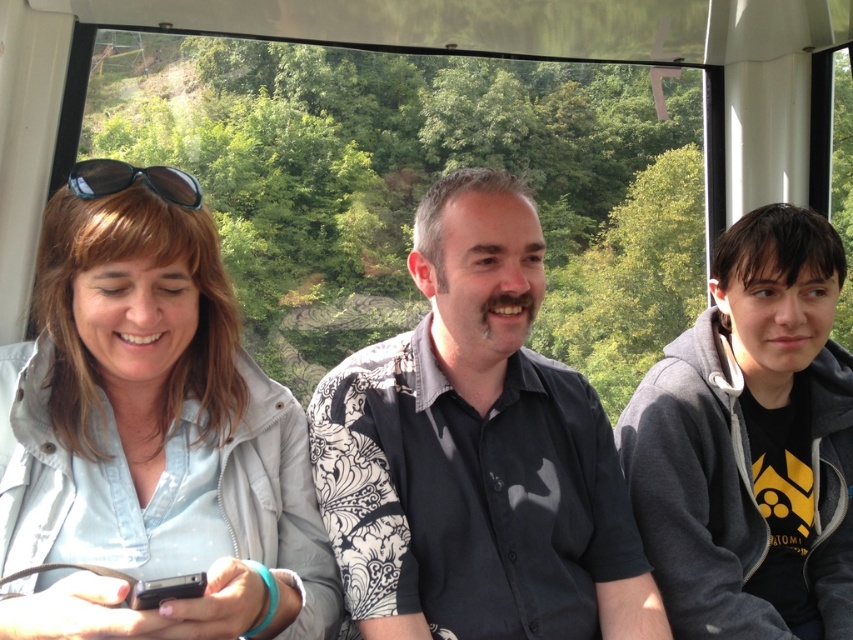
Question: Which point appears closest to the camera in this image?

Choices:
 (A) click(x=776, y=312)
 (B) click(x=466, y=337)
 (C) click(x=135, y=388)

Answer: (C)

Question: Is light blue denim jacket at left in front of gray hoodie at right?

Choices:
 (A) no
 (B) yes

Answer: (B)

Question: Is gray hoodie at right below shiny black sunglasses at left?

Choices:
 (A) yes
 (B) no

Answer: (A)

Question: Which point appears farthest from the camera in this image?

Choices:
 (A) (642, 481)
 (B) (62, 579)
 (C) (561, 396)

Answer: (A)

Question: Can you confirm if dark gray shirt at center is smaller than shiny black sunglasses at left?

Choices:
 (A) yes
 (B) no

Answer: (B)

Question: Which object is closer to the camera taking this photo?

Choices:
 (A) dark gray shirt at center
 (B) gray hoodie at right
 (C) light blue denim jacket at left
 (D) shiny black sunglasses at left

Answer: (C)